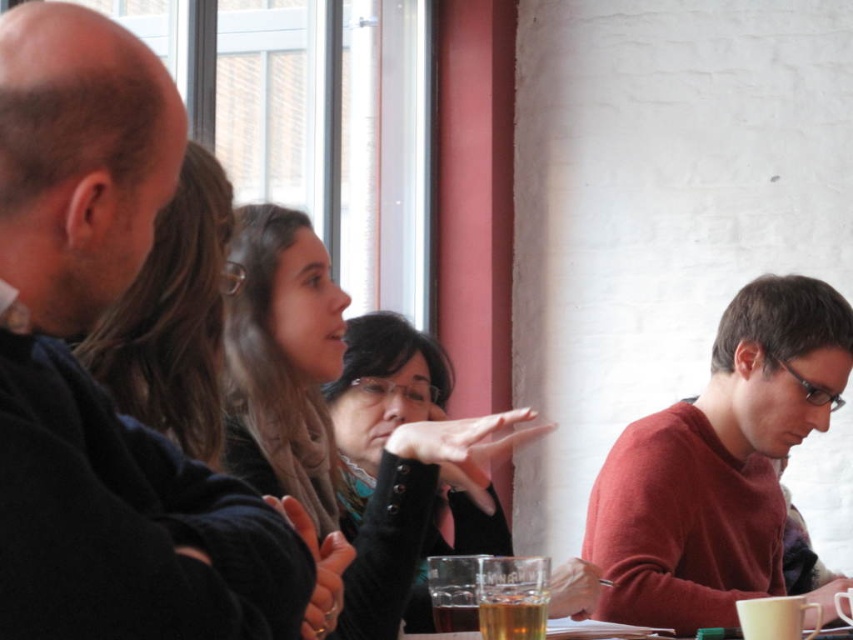
Is smooth black shirt at left above translucent glass beverage at center?

Yes.

Is smooth black shirt at left to the left of translucent glass beverage at center from the viewer's perspective?

Indeed, smooth black shirt at left is positioned on the left side of translucent glass beverage at center.

Between point (54, 157) and point (537, 595), which one is positioned in front?

Point (54, 157) is more forward.

Locate an element on the screen. This screenshot has height=640, width=853. smooth black shirt at left is located at coordinates (91, 380).

Is matte black hair at upper left to the right of translucent glass beverage at center from the viewer's perspective?

In fact, matte black hair at upper left is to the left of translucent glass beverage at center.

Which is behind, point (109, 374) or point (500, 612)?

The point (500, 612) is more distant.

Identify the location of matte black hair at upper left. Image resolution: width=853 pixels, height=640 pixels. (173, 317).

Describe the element at coordinates (718, 464) in the screenshot. I see `matte red sweater at right` at that location.

Can you confirm if matte red sweater at right is taller than translucent glass beverage at center?

Yes, matte red sweater at right is taller than translucent glass beverage at center.

Is point (633, 472) positioned before point (480, 624)?

That is False.

Image resolution: width=853 pixels, height=640 pixels. I want to click on matte red sweater at right, so click(718, 464).